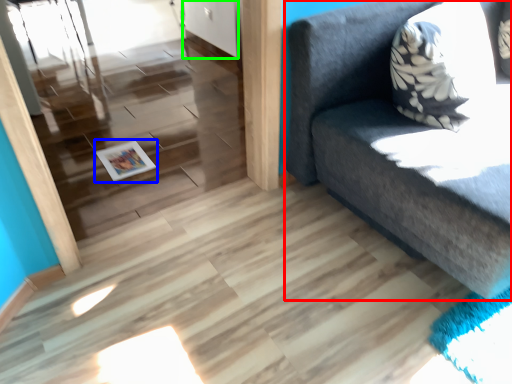
Question: Based on their relative distances, which object is farther from studio couch (highlighted by a red box)? Choose from magazine (highlighted by a blue box) and door (highlighted by a green box).

Choices:
 (A) magazine
 (B) door

Answer: (B)